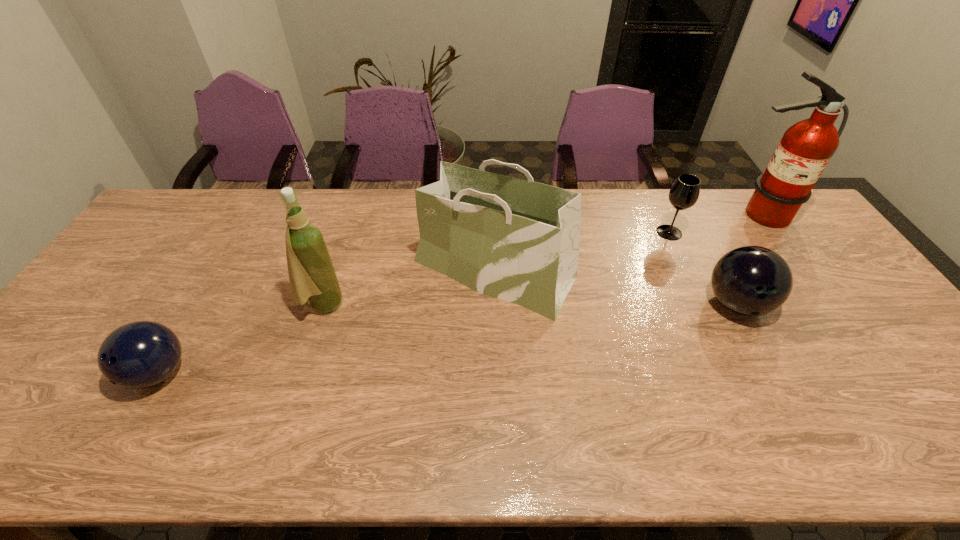
Locate an element on the screen. The width and height of the screenshot is (960, 540). vacant space at the far edge is located at coordinates (614, 201).

This screenshot has width=960, height=540. In the image, there is a desktop. Find the location of `vacant space at the near edge`. vacant space at the near edge is located at coordinates (525, 455).

In the image, there is a desktop. Where is `vacant space at the left edge`? The image size is (960, 540). vacant space at the left edge is located at coordinates (120, 261).

Locate an element on the screen. vacant space at the right edge is located at coordinates (923, 421).

I want to click on vacant region at the far left corner, so click(x=218, y=193).

In the image, there is a desktop. Where is `vacant space at the near left corner`? vacant space at the near left corner is located at coordinates (42, 451).

You are a GUI agent. You are given a task and a screenshot of the screen. Output one action in this format:
    pyautogui.click(x=<x>, y=<y>)
    Task: Click on the empty space that is in between the nearest object and the taller bowling ball
    
    Given the screenshot: What is the action you would take?
    pyautogui.click(x=447, y=339)

At what (x,y) coordinates should I click in order to perform the action: click on vacant area that lies between the fifth object from right to left and the left bowling ball. Please return your answer as a coordinate pair (x, y). The height and width of the screenshot is (540, 960). Looking at the image, I should click on tap(240, 339).

Image resolution: width=960 pixels, height=540 pixels. Find the location of `vacant point located between the grocery bag and the rightmost object`. vacant point located between the grocery bag and the rightmost object is located at coordinates (626, 243).

This screenshot has height=540, width=960. I want to click on free spot between the wineglass and the right bowling ball, so click(x=703, y=268).